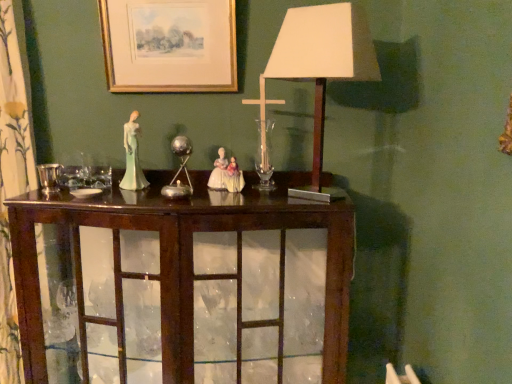
Question: From the image's perspective, would you say porcelain figure at center is shown under white paper lampshade at center?

Choices:
 (A) no
 (B) yes

Answer: (B)

Question: Are porcelain figure at center and white paper lampshade at center far apart?

Choices:
 (A) yes
 (B) no

Answer: (B)

Question: Can you confirm if porcelain figure at center is wider than white paper lampshade at center?

Choices:
 (A) no
 (B) yes

Answer: (A)

Question: Considering the relative positions of porcelain figure at center and white paper lampshade at center in the image provided, is porcelain figure at center to the right of white paper lampshade at center from the viewer's perspective?

Choices:
 (A) no
 (B) yes

Answer: (A)

Question: Is porcelain figure at center looking in the opposite direction of white paper lampshade at center?

Choices:
 (A) yes
 (B) no

Answer: (B)

Question: Is white paper lampshade at center situated inside metallic silver candle holder at center, which is the first candle holder in right-to-left order, or outside?

Choices:
 (A) outside
 (B) inside

Answer: (A)

Question: Based on their positions, is white paper lampshade at center located to the left or right of metallic silver candle holder at center, which is the first candle holder in right-to-left order?

Choices:
 (A) right
 (B) left

Answer: (A)

Question: Does point click(284, 79) appear closer or farther from the camera than point click(182, 142)?

Choices:
 (A) closer
 (B) farther

Answer: (B)

Question: In terms of size, does white paper lampshade at center appear bigger or smaller than metallic silver candle holder at center, arranged as the 2th candle holder when viewed from the left?

Choices:
 (A) small
 (B) big

Answer: (B)

Question: Is point pos(55,178) closer or farther from the camera than point pos(145,67)?

Choices:
 (A) farther
 (B) closer

Answer: (B)

Question: Considering the positions of shiny silver candle holder at left, marked as the second candle holder in a back-to-front arrangement, and gold-framed print at upper center in the image, is shiny silver candle holder at left, marked as the second candle holder in a back-to-front arrangement, wider or thinner than gold-framed print at upper center?

Choices:
 (A) thin
 (B) wide

Answer: (B)

Question: From the image's perspective, relative to gold-framed print at upper center, is shiny silver candle holder at left, the 1th candle holder from the front, above or below?

Choices:
 (A) below
 (B) above

Answer: (A)

Question: Do you think shiny silver candle holder at left, the 1th candle holder from the front, is within gold-framed print at upper center, or outside of it?

Choices:
 (A) inside
 (B) outside

Answer: (B)

Question: In terms of size, does mahogany cabinet at center appear bigger or smaller than metallic silver candle holder at center, arranged as the 2th candle holder when viewed from the left?

Choices:
 (A) big
 (B) small

Answer: (A)

Question: Visually, is mahogany cabinet at center positioned to the left or to the right of metallic silver candle holder at center, arranged as the 2th candle holder when viewed from the left?

Choices:
 (A) right
 (B) left

Answer: (B)